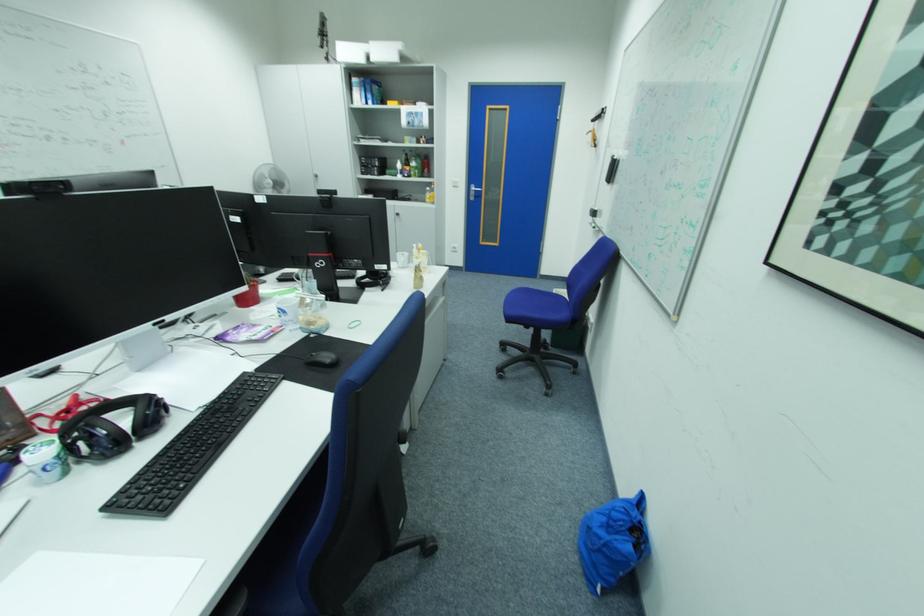
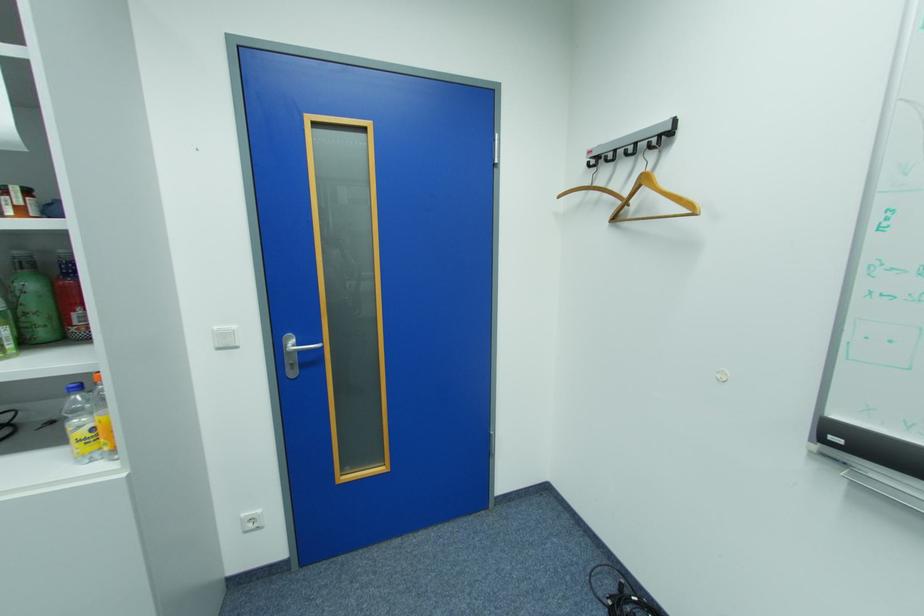
Locate, in the second image, the point that corresponds to point 429,163 in the first image.

(41, 286)